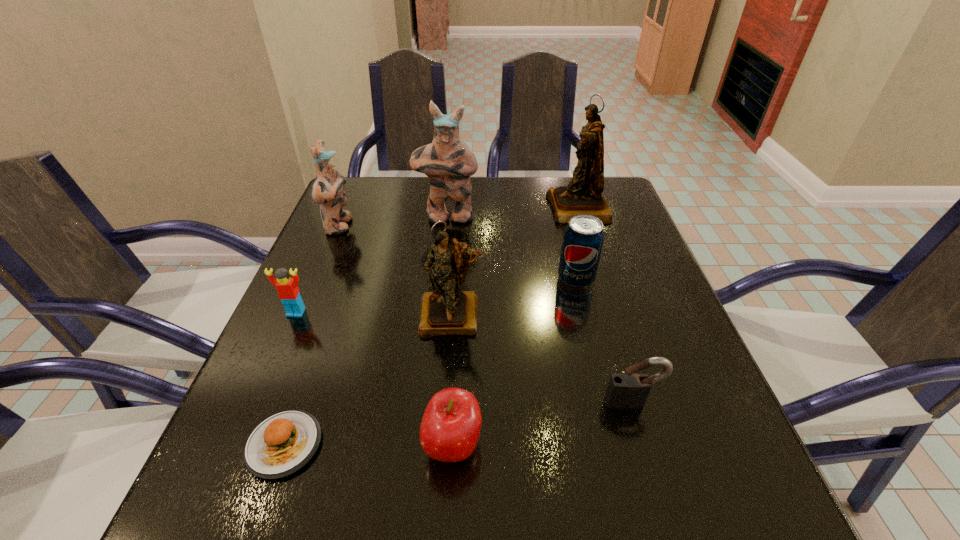
The image size is (960, 540). Find the location of `free region at the near right corner of the desktop`. free region at the near right corner of the desktop is located at coordinates (721, 516).

Where is `free spot between the right pink figurine and the sixth nearest object`? free spot between the right pink figurine and the sixth nearest object is located at coordinates (512, 248).

Image resolution: width=960 pixels, height=540 pixels. What are the coordinates of `free space between the smaller pink figurine and the left gold figurine` in the screenshot? It's located at (396, 271).

This screenshot has width=960, height=540. I want to click on empty space that is in between the red Lego and the right pink figurine, so click(372, 265).

This screenshot has width=960, height=540. I want to click on vacant space that's between the left gold figurine and the seventh farthest object, so click(542, 359).

Locate an element on the screen. Image resolution: width=960 pixels, height=540 pixels. unoccupied position between the Lego and the right pink figurine is located at coordinates pyautogui.click(x=372, y=265).

The image size is (960, 540). Identify the location of vacant area that lies between the seventh farthest object and the bigger pink figurine. (540, 309).

I want to click on free point between the red apple and the padlock, so pos(542,423).

Find the location of a particular element. free space between the Lego and the smaller pink figurine is located at coordinates (318, 269).

Where is `object that is the third closest to the third nearest object`? The height and width of the screenshot is (540, 960). object that is the third closest to the third nearest object is located at coordinates (583, 238).